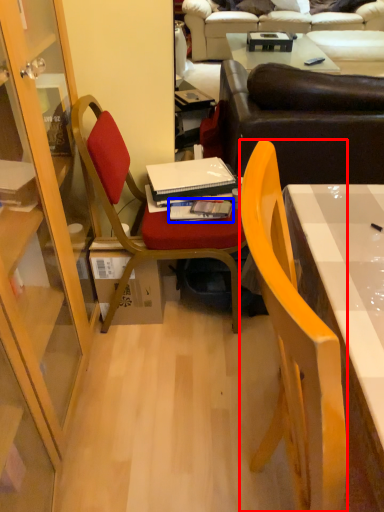
Question: Which point is further to the camera, chair (highlighted by a red box) or book (highlighted by a blue box)?

Choices:
 (A) chair
 (B) book

Answer: (B)